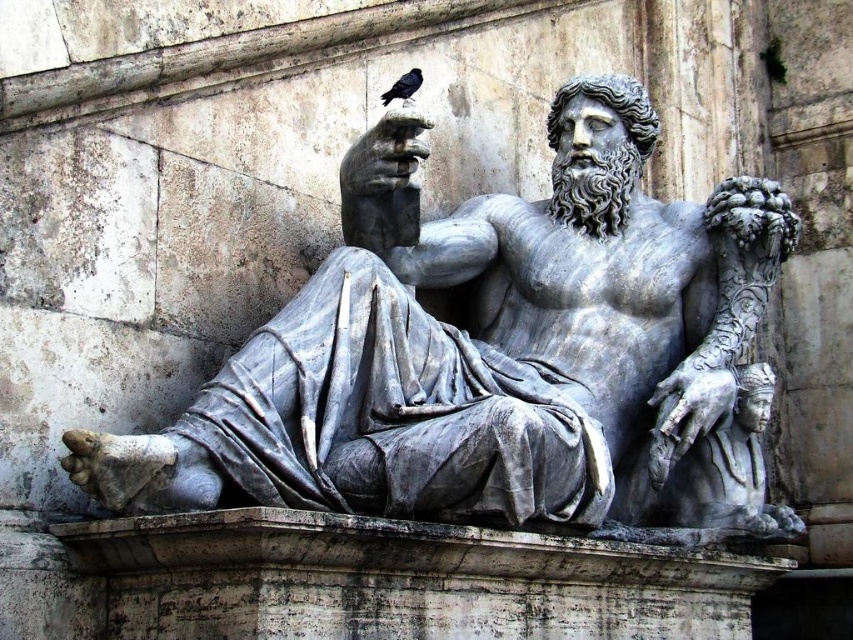
Between gray marble statue at center and black feathered bird at upper center, which one is positioned lower?

gray marble statue at center

Which is behind, point (566, 150) or point (413, 76)?

Point (566, 150)

Is point (695, 324) in front of point (402, 77)?

Yes, point (695, 324) is in front of point (402, 77).

The height and width of the screenshot is (640, 853). Find the location of `gray marble statue at center`. gray marble statue at center is located at coordinates (498, 353).